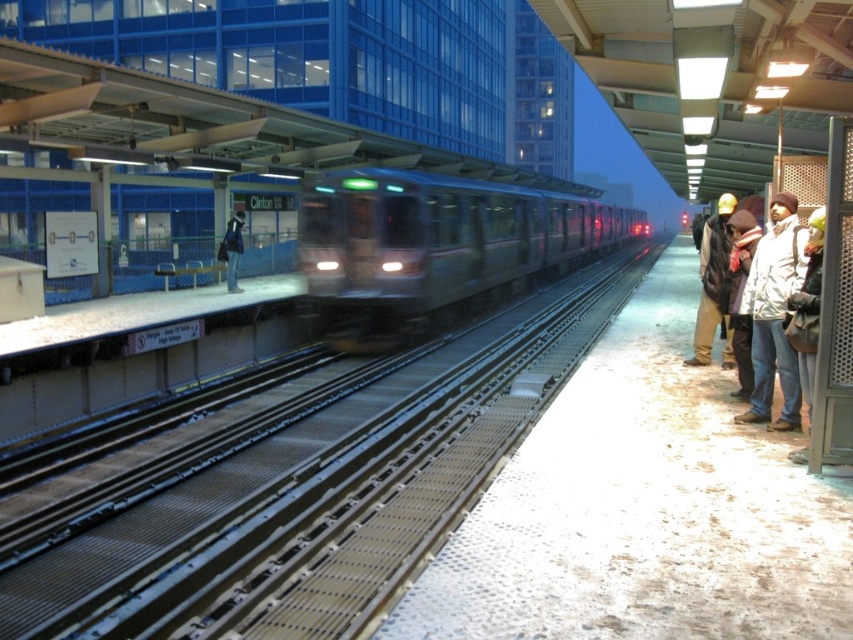
Question: Is brown woolen hat at right to the right of dark blue jacket at center from the viewer's perspective?

Choices:
 (A) yes
 (B) no

Answer: (A)

Question: Among these points, which one is nearest to the camera?

Choices:
 (A) (229, 228)
 (B) (521, 285)
 (C) (755, 326)

Answer: (C)

Question: Among these objects, which one is farthest from the camera?

Choices:
 (A) metallic silver train at center
 (B) brown woolen hat at right

Answer: (A)

Question: Does metallic silver train at center lie behind brown woolen hat at right?

Choices:
 (A) yes
 (B) no

Answer: (A)

Question: Can you confirm if metallic silver train at center is bigger than brown woolen hat at right?

Choices:
 (A) yes
 (B) no

Answer: (A)

Question: Among these points, which one is farthest from the camera?

Choices:
 (A) [466, 232]
 (B) [229, 248]

Answer: (A)